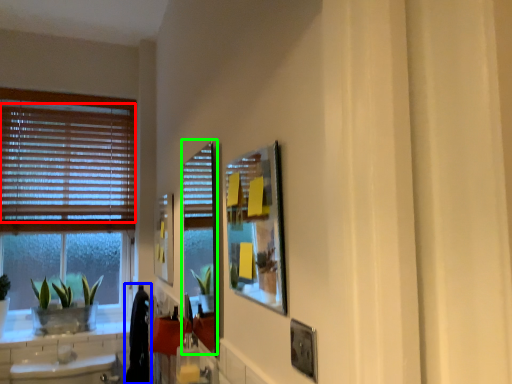
Question: Which object is the closest to the blind (highlighted by a red box)? Choose among these: laundry (highlighted by a blue box) or screen door (highlighted by a green box).

Choices:
 (A) laundry
 (B) screen door

Answer: (B)